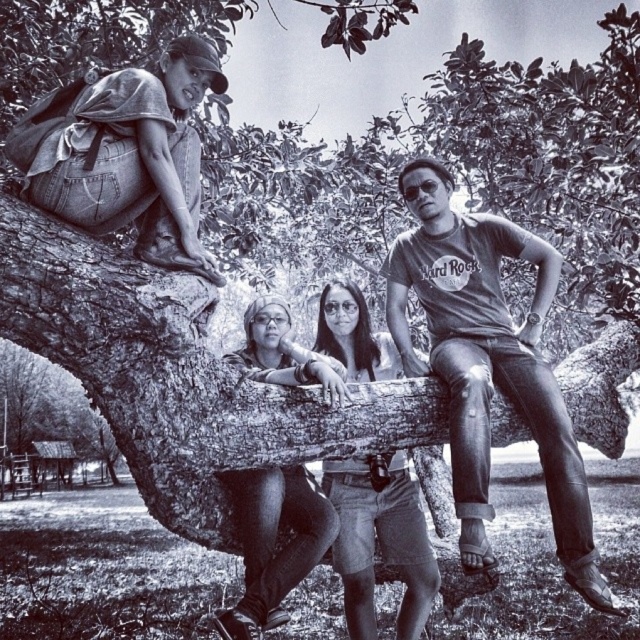
Question: Which point is farther to the camera?

Choices:
 (A) hard rock t-shirt at center
 (B) denim shorts at center
 (C) matte black pants at center

Answer: (B)

Question: Does hard rock t-shirt at center lie behind matte black pants at center?

Choices:
 (A) no
 (B) yes

Answer: (A)

Question: Which point is farther to the camera?

Choices:
 (A) (390, 314)
 (B) (268, 611)

Answer: (A)

Question: Which point is farther to the camera?

Choices:
 (A) (275, 310)
 (B) (490, 227)

Answer: (A)

Question: In this image, where is denim shorts at center located relative to matte black pants at center?

Choices:
 (A) above
 (B) below

Answer: (B)

Question: Does hard rock t-shirt at center have a greater width compared to matte black pants at center?

Choices:
 (A) yes
 (B) no

Answer: (A)